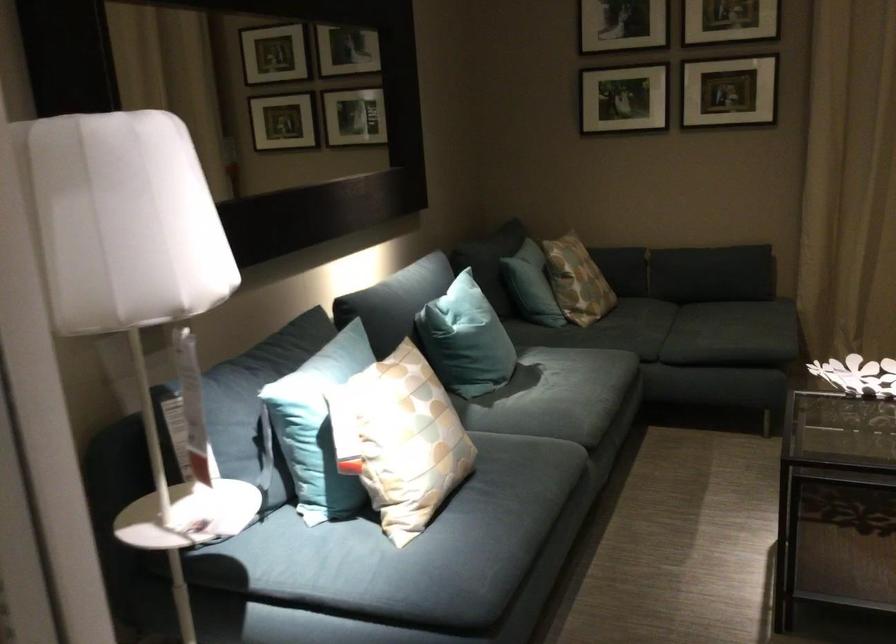
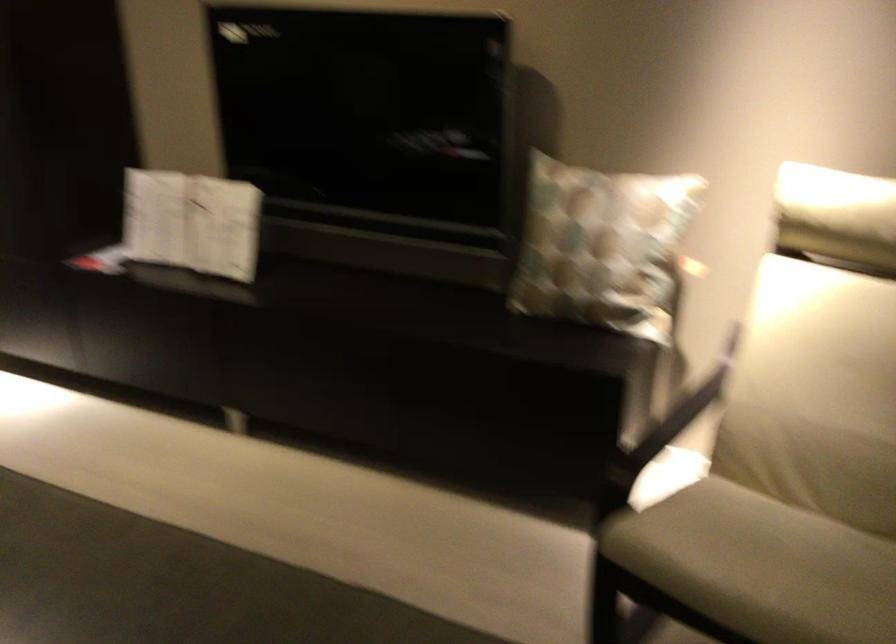
Question: The camera is either moving clockwise (left) or counter-clockwise (right) around the object. The first image is from the beginning of the video and the second image is from the end. Is the camera moving left or right when shooting the video?

Choices:
 (A) Left
 (B) Right

Answer: (A)